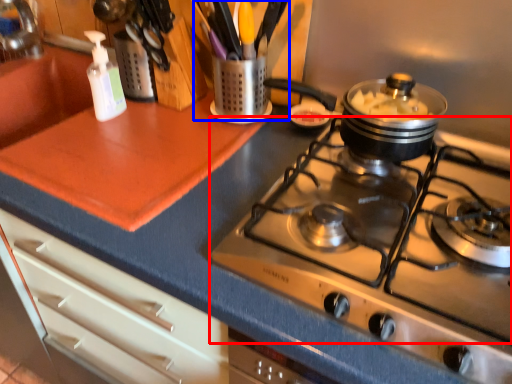
Question: Which point is further to the camera, gas stove (highlighted by a red box) or appliance (highlighted by a blue box)?

Choices:
 (A) gas stove
 (B) appliance

Answer: (B)